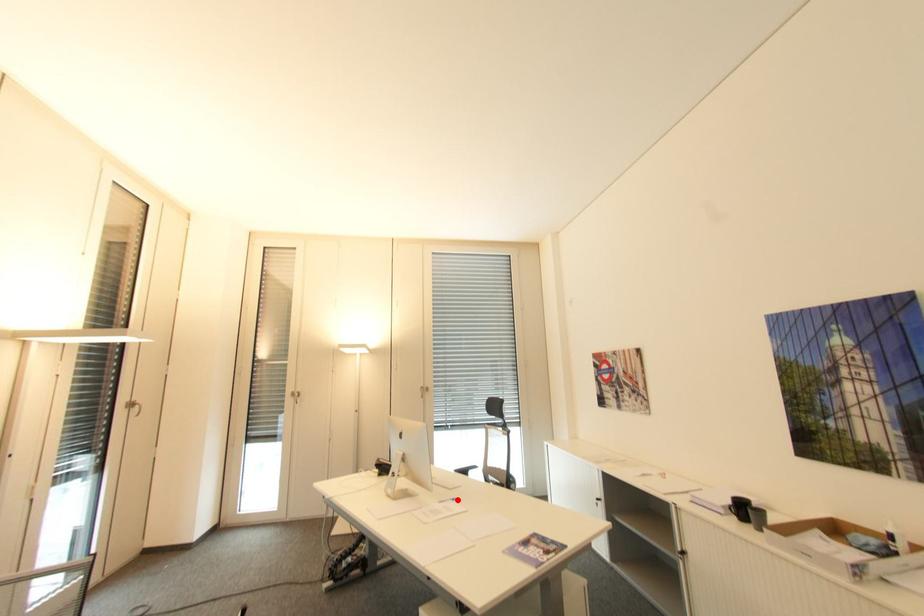
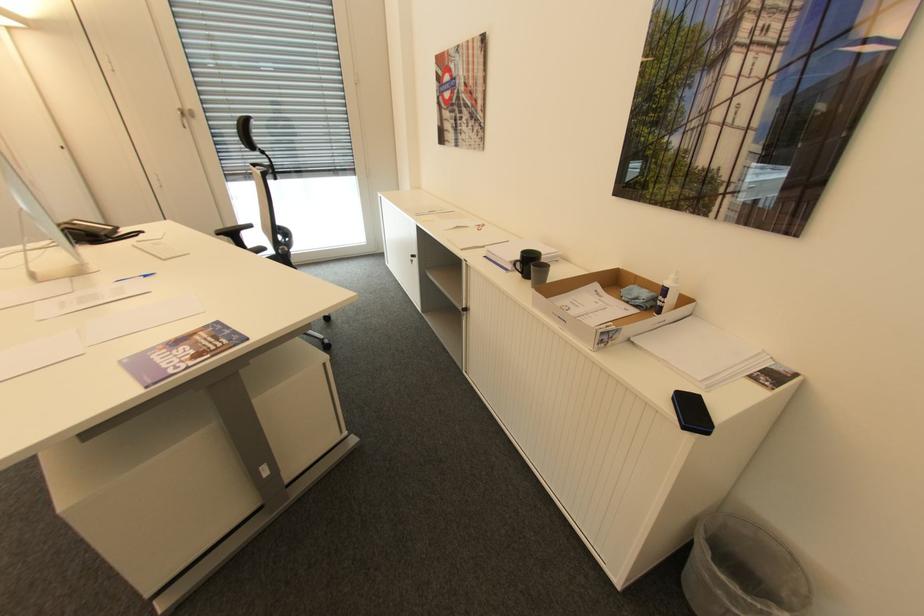
In the second image, find the point that corresponds to the highlighted location in the first image.

(150, 276)